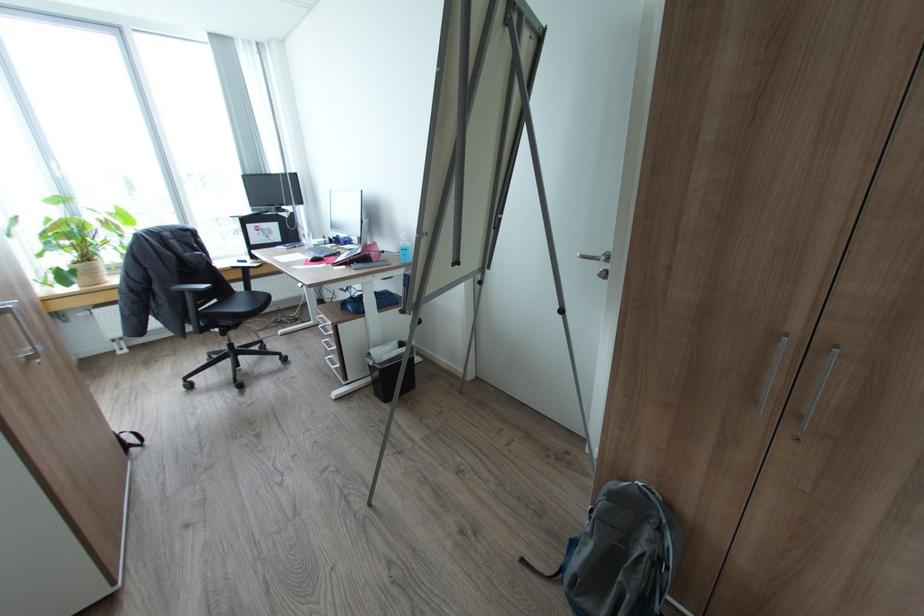
This screenshot has width=924, height=616. What do you see at coordinates (405, 249) in the screenshot? I see `the bottle pump` at bounding box center [405, 249].